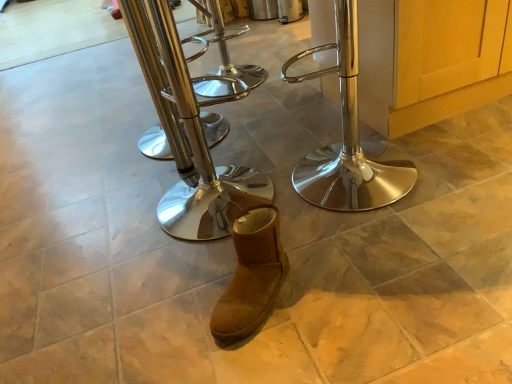
Locate an element on the screen. This screenshot has height=384, width=512. free area behind polished chrome stool at center, the second step stool viewed from the right is located at coordinates (218, 155).